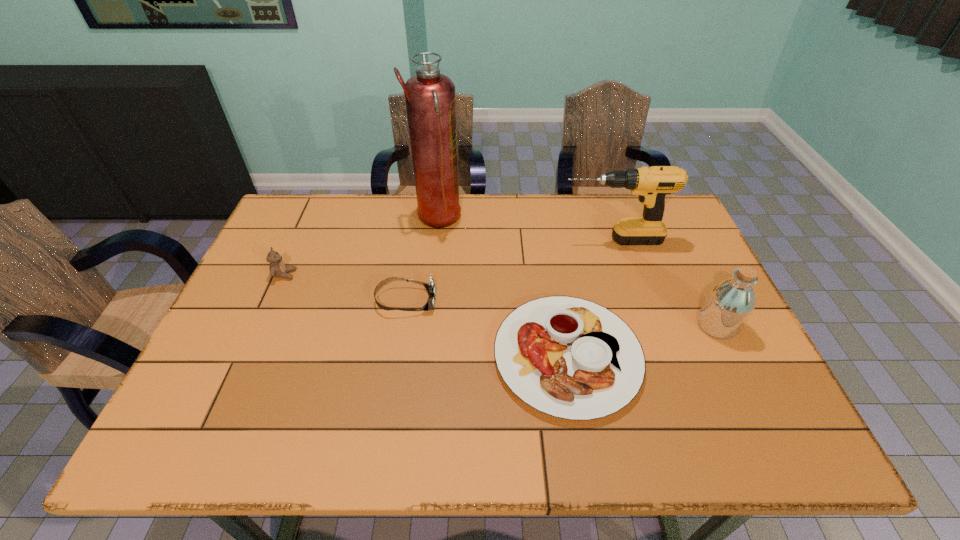
What are the coordinates of `vacant area between the fire extinguisher and the fifth shortest object` in the screenshot? It's located at (524, 230).

The width and height of the screenshot is (960, 540). What are the coordinates of `empty location between the third farthest object and the shortest object` in the screenshot? It's located at (426, 315).

You are a GUI agent. You are given a task and a screenshot of the screen. Output one action in this format:
    pyautogui.click(x=<x>, y=<y>)
    Task: Click on the vacant space that is in between the leftmost object and the fire extinguisher
    
    Given the screenshot: What is the action you would take?
    pyautogui.click(x=361, y=247)

This screenshot has width=960, height=540. Find the location of `free space between the fifth shortest object and the fourth nearest object`. free space between the fifth shortest object and the fourth nearest object is located at coordinates (448, 258).

Locate an element on the screen. The image size is (960, 540). unoccupied position between the fire extinguisher and the drill is located at coordinates (524, 230).

At what (x,y) coordinates should I click in order to perform the action: click on free space that is in between the second tallest object and the leftmost object. Please return your answer as a coordinate pair (x, y). This screenshot has width=960, height=540. Looking at the image, I should click on (448, 258).

Where is `unoccupied position between the goggles and the drill`? This screenshot has height=540, width=960. unoccupied position between the goggles and the drill is located at coordinates (509, 271).

Select which object is the fourth closest to the bottle. Please provide its 2D coordinates. Your answer should be formatted as a tuple, i.e. [(x, y)], where the tuple contains the x and y coordinates of a point satisfying the conditions above.

[(430, 101)]

Find the location of a particular element. object that is the third closest to the tallest object is located at coordinates (652, 184).

Locate an element on the screen. This screenshot has height=540, width=960. vacant space that satisfies the following two spatial constraints: 1. at the tip of the third tallest object; 2. on the right side of the drill is located at coordinates pyautogui.click(x=639, y=326).